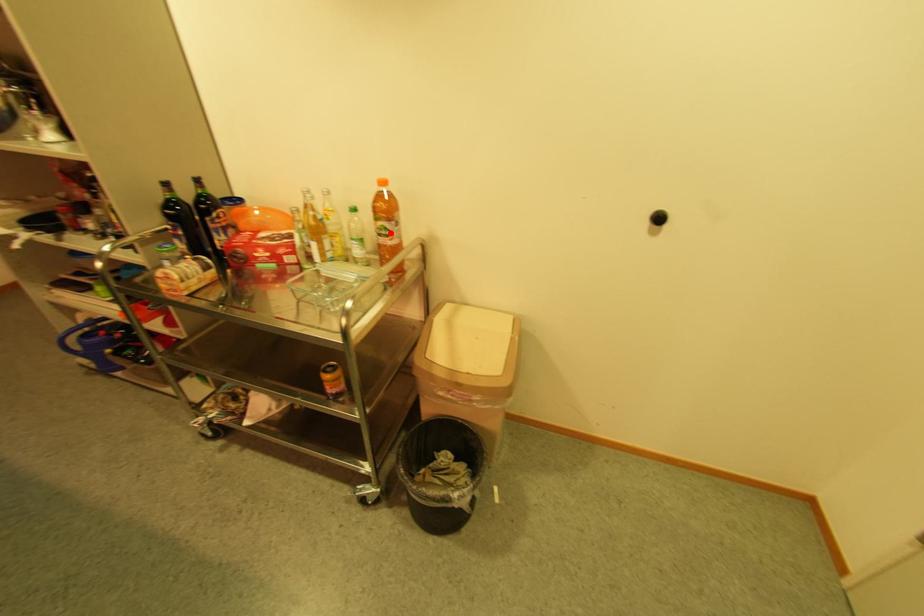
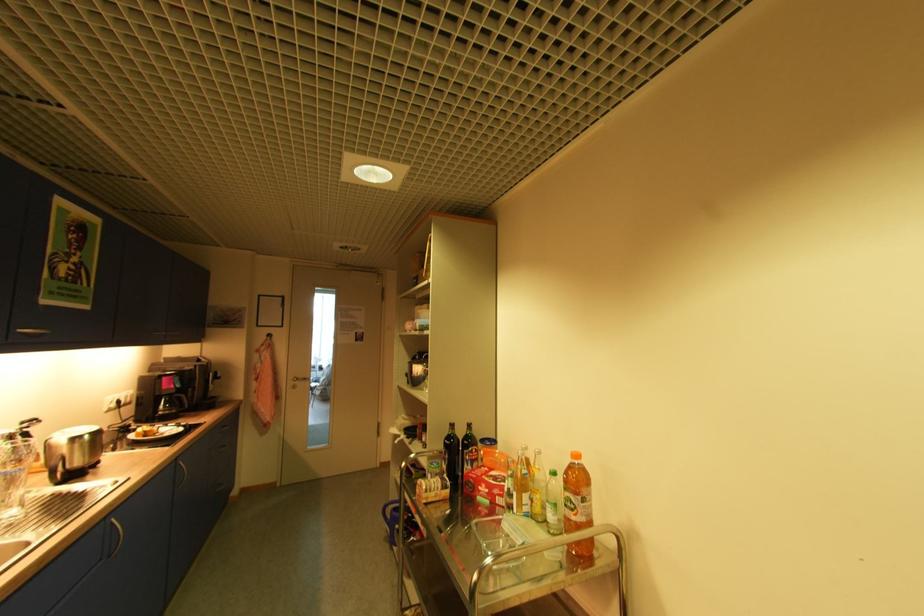
The point at the highlighted location is marked in the first image. Where is the corresponding point in the second image?

(575, 506)